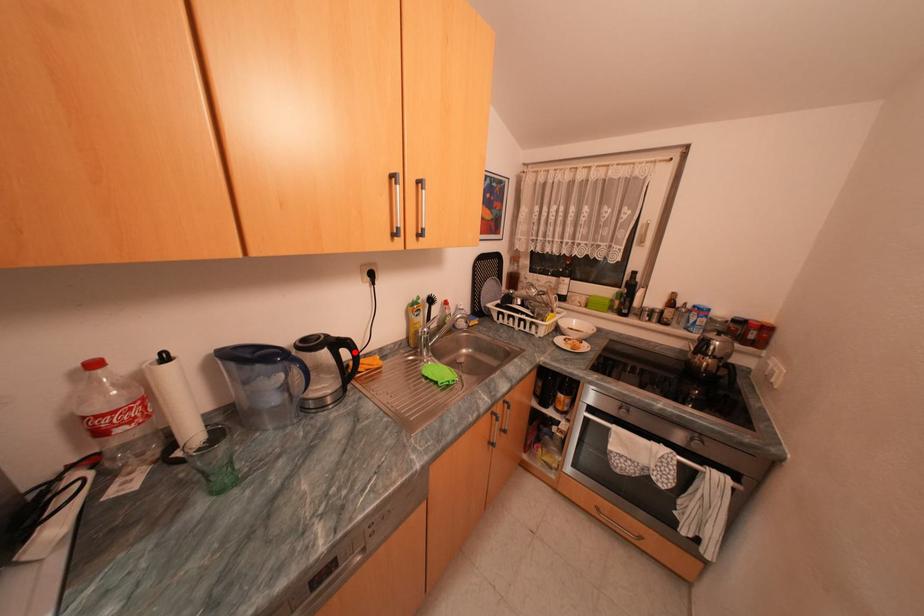
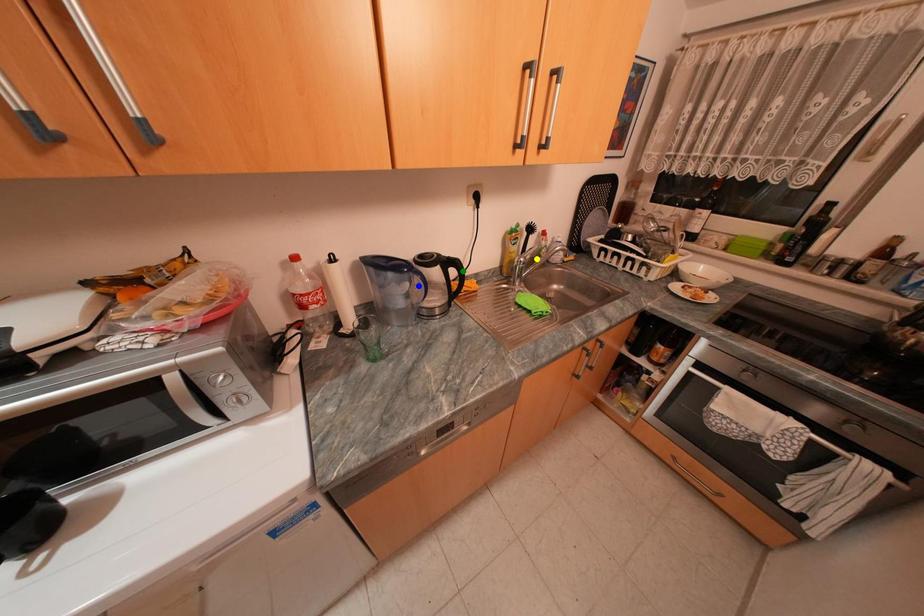
Question: I am providing you with two images of the same scene from different viewpoints. A red point is marked on the first image. You are given multiple points on the second image. Which spot in image 2 lines up with the point in image 1?

Choices:
 (A) green point
 (B) blue point
 (C) yellow point

Answer: (A)